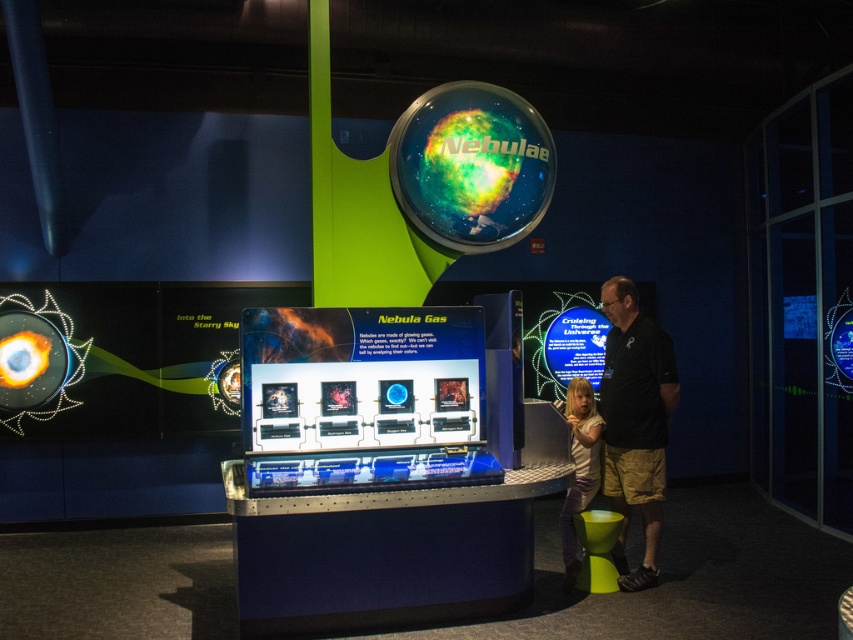
Is black cotton shirt at right in front of matte yellow stool at lower right?

Yes, black cotton shirt at right is closer to the viewer.

Can you confirm if black cotton shirt at right is positioned to the right of matte yellow stool at lower right?

Indeed, black cotton shirt at right is positioned on the right side of matte yellow stool at lower right.

Locate an element on the screen. The image size is (853, 640). black cotton shirt at right is located at coordinates (635, 420).

Where is `black cotton shirt at right`? Image resolution: width=853 pixels, height=640 pixels. black cotton shirt at right is located at coordinates (635, 420).

Is black cotton shirt at right to the left of light brown hair at lower right from the viewer's perspective?

Incorrect, black cotton shirt at right is not on the left side of light brown hair at lower right.

Consider the image. Between black cotton shirt at right and light brown hair at lower right, which one has more height?

With more height is black cotton shirt at right.

Which is behind, point (639, 328) or point (567, 579)?

The point (567, 579) is more distant.

I want to click on black cotton shirt at right, so click(635, 420).

Does light brown hair at lower right have a greater height compared to matte yellow stool at lower right?

Indeed, light brown hair at lower right has a greater height compared to matte yellow stool at lower right.

Is light brown hair at lower right thinner than matte yellow stool at lower right?

Yes, light brown hair at lower right is thinner than matte yellow stool at lower right.

The image size is (853, 640). What are the coordinates of `light brown hair at lower right` in the screenshot? It's located at (579, 467).